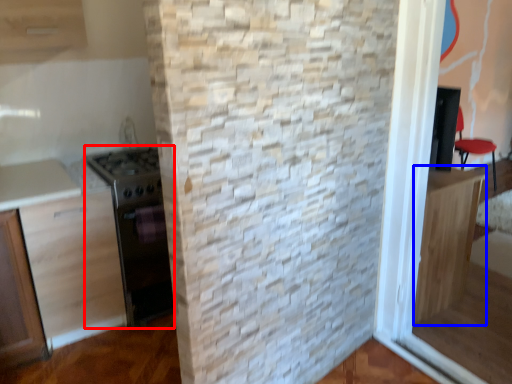
Question: Which point is further to the camera, appliance (highlighted by a red box) or cabinetry (highlighted by a blue box)?

Choices:
 (A) appliance
 (B) cabinetry

Answer: (A)